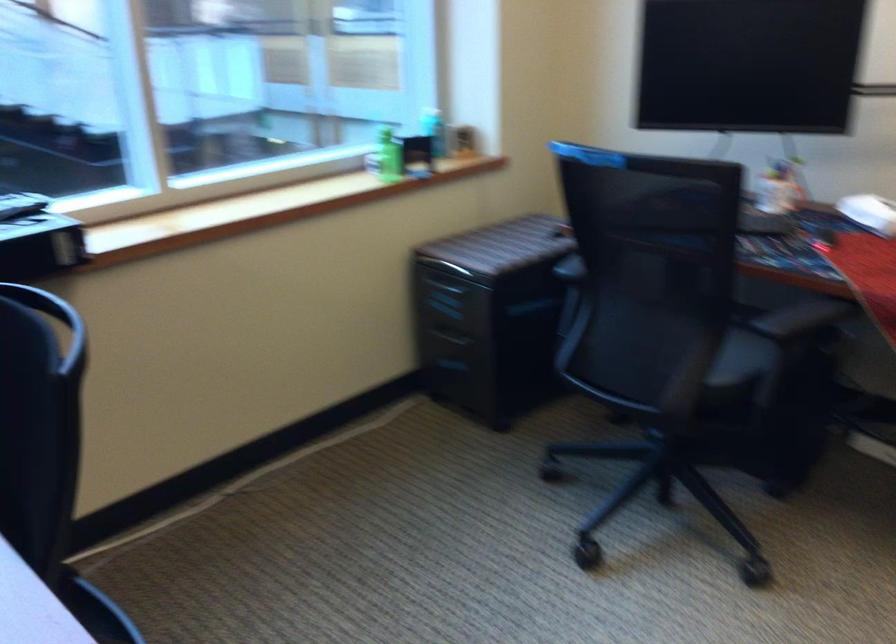
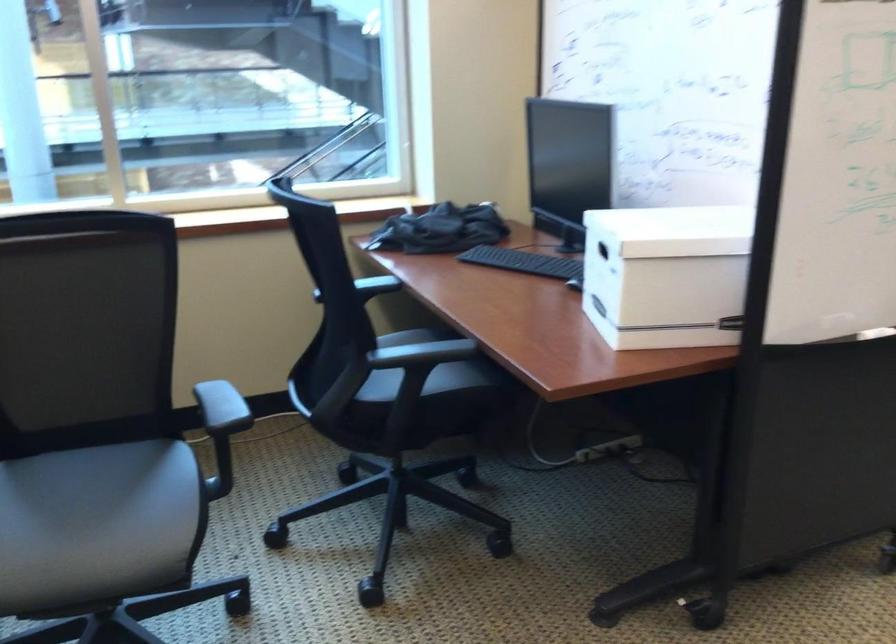
Question: What movement of the cameraman would produce the second image?

Choices:
 (A) Left
 (B) Right
 (C) Forward
 (D) Backward

Answer: (D)